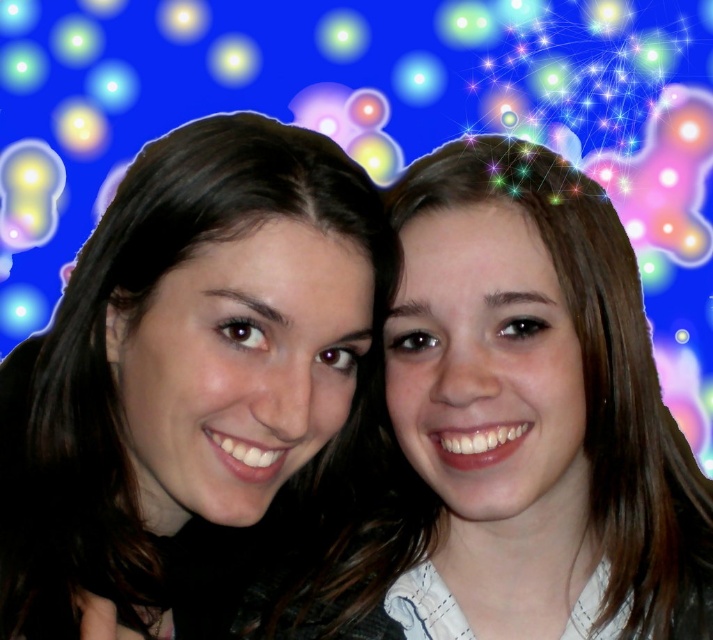
Question: Which point is farther from the camera taking this photo?

Choices:
 (A) (555, 561)
 (B) (230, 522)

Answer: (A)

Question: Is smooth skin face at center in front of smooth skin face at right?

Choices:
 (A) no
 (B) yes

Answer: (A)

Question: Which object is farther from the camera taking this photo?

Choices:
 (A) smooth skin face at right
 (B) smooth skin face at center

Answer: (B)

Question: Does smooth skin face at center have a lesser width compared to smooth skin face at right?

Choices:
 (A) yes
 (B) no

Answer: (B)

Question: Which object is closer to the camera taking this photo?

Choices:
 (A) smooth skin face at right
 (B) smooth skin face at center

Answer: (A)

Question: Is smooth skin face at center to the right of smooth skin face at right from the viewer's perspective?

Choices:
 (A) no
 (B) yes

Answer: (A)